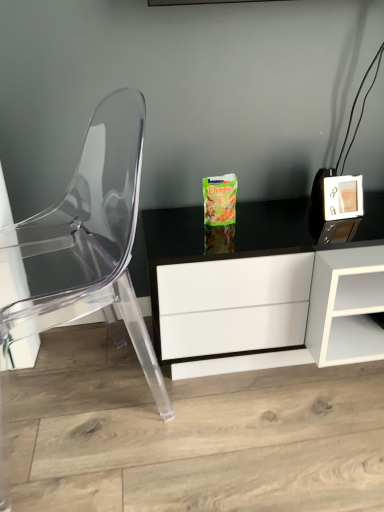
Measure the distance between transparent plastic chair at left and camera.

transparent plastic chair at left is 32.47 inches from camera.

The width and height of the screenshot is (384, 512). Identify the location of transparent plastic chair at left. [x=84, y=241].

Describe the element at coordinates (84, 241) in the screenshot. The image size is (384, 512). I see `transparent plastic chair at left` at that location.

This screenshot has height=512, width=384. Describe the element at coordinates (245, 279) in the screenshot. I see `green matte snack packet at center` at that location.

What is the approximate height of green matte snack packet at center?

16.48 inches.

You are a GUI agent. You are given a task and a screenshot of the screen. Output one action in this format:
    pyautogui.click(x=<x>, y=<y>)
    Task: Click on the green matte snack packet at center
    This screenshot has height=512, width=384.
    Given the screenshot: What is the action you would take?
    pyautogui.click(x=245, y=279)

Where is `transparent plastic chair at left`? transparent plastic chair at left is located at coordinates (84, 241).

Considering the relative positions of transparent plastic chair at left and green matte snack packet at center in the image provided, is transparent plastic chair at left to the left or to the right of green matte snack packet at center?

transparent plastic chair at left is positioned on green matte snack packet at center's left side.

Which object is more forward, transparent plastic chair at left or green matte snack packet at center?

transparent plastic chair at left.

Does point (101, 131) come behind point (152, 269)?

Yes, it is behind point (152, 269).

From the image's perspective, is transparent plastic chair at left over green matte snack packet at center?

Correct, transparent plastic chair at left appears higher than green matte snack packet at center in the image.

From a real-world perspective, is transparent plastic chair at left on green matte snack packet at center?

Yes, from a real-world perspective, transparent plastic chair at left is over green matte snack packet at center

Considering the relative sizes of transparent plastic chair at left and green matte snack packet at center in the image provided, is transparent plastic chair at left wider than green matte snack packet at center?

In fact, transparent plastic chair at left might be narrower than green matte snack packet at center.

Between transparent plastic chair at left and green matte snack packet at center, which one has less height?

With less height is green matte snack packet at center.

Considering the sizes of transparent plastic chair at left and green matte snack packet at center in the image, is transparent plastic chair at left bigger or smaller than green matte snack packet at center?

In the image, transparent plastic chair at left appears to be larger than green matte snack packet at center.

Is transparent plastic chair at left not inside green matte snack packet at center?

That's correct, transparent plastic chair at left is outside of green matte snack packet at center.

Are transparent plastic chair at left and green matte snack packet at center making contact?

No, transparent plastic chair at left is not next to green matte snack packet at center.

Is transparent plastic chair at left facing away from green matte snack packet at center?

Yes, green matte snack packet at center is at the back of transparent plastic chair at left.

How many degrees apart are the facing directions of transparent plastic chair at left and green matte snack packet at center?

transparent plastic chair at left and green matte snack packet at center are facing 65.5 degrees away from each other.

There is a green matte snack packet at center. Find the location of `chair above it (from a real-world perspective)`. chair above it (from a real-world perspective) is located at coordinates (84, 241).

Which is more to the left, green matte snack packet at center or transparent plastic chair at left?

transparent plastic chair at left.

Considering the positions of objects green matte snack packet at center and transparent plastic chair at left in the image provided, who is behind, green matte snack packet at center or transparent plastic chair at left?

green matte snack packet at center is further away from the camera.

Between point (278, 280) and point (141, 338), which one is positioned in front?

The point (278, 280) is closer to the camera.

From the image's perspective, is green matte snack packet at center under transparent plastic chair at left?

Yes, from the image's perspective, green matte snack packet at center is beneath transparent plastic chair at left.

From a real-world perspective, between green matte snack packet at center and transparent plastic chair at left, who is vertically higher?

From a 3D spatial view, transparent plastic chair at left is above.

From the picture: Can you confirm if green matte snack packet at center is thinner than transparent plastic chair at left?

Incorrect, the width of green matte snack packet at center is not less than that of transparent plastic chair at left.

Is green matte snack packet at center taller than transparent plastic chair at left?

No.

Considering the sizes of green matte snack packet at center and transparent plastic chair at left in the image, is green matte snack packet at center bigger or smaller than transparent plastic chair at left?

Considering their sizes, green matte snack packet at center takes up less space than transparent plastic chair at left.

Do you think green matte snack packet at center is within transparent plastic chair at left, or outside of it?

green matte snack packet at center exists outside the volume of transparent plastic chair at left.

Is green matte snack packet at center not close to transparent plastic chair at left?

They are positioned close to each other.

Is green matte snack packet at center aimed at transparent plastic chair at left?

No, green matte snack packet at center does not turn towards transparent plastic chair at left.

How distant is green matte snack packet at center from transparent plastic chair at left?

green matte snack packet at center is 12.22 inches away from transparent plastic chair at left.

The width and height of the screenshot is (384, 512). In order to click on table behind the transparent plastic chair at left in this screenshot , I will do `click(245, 279)`.

This screenshot has height=512, width=384. Identify the location of chair on the left of green matte snack packet at center. (84, 241).

Identify the location of table behind the transparent plastic chair at left. The width and height of the screenshot is (384, 512). (245, 279).